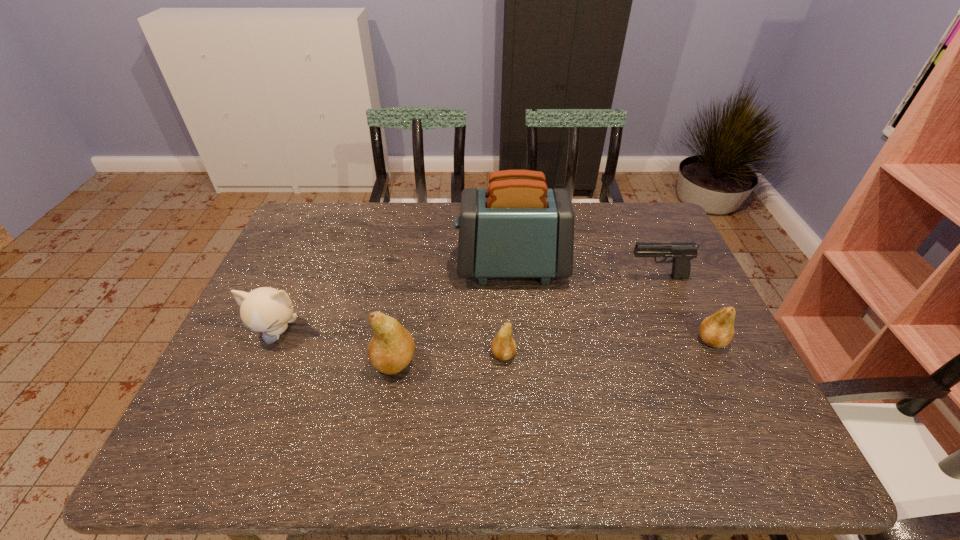
Please point a location where one more pear can be added evenly. Please provide its 2D coordinates. Your answer should be formatted as a tuple, i.e. [(x, y)], where the tuple contains the x and y coordinates of a point satisfying the conditions above.

[(609, 348)]